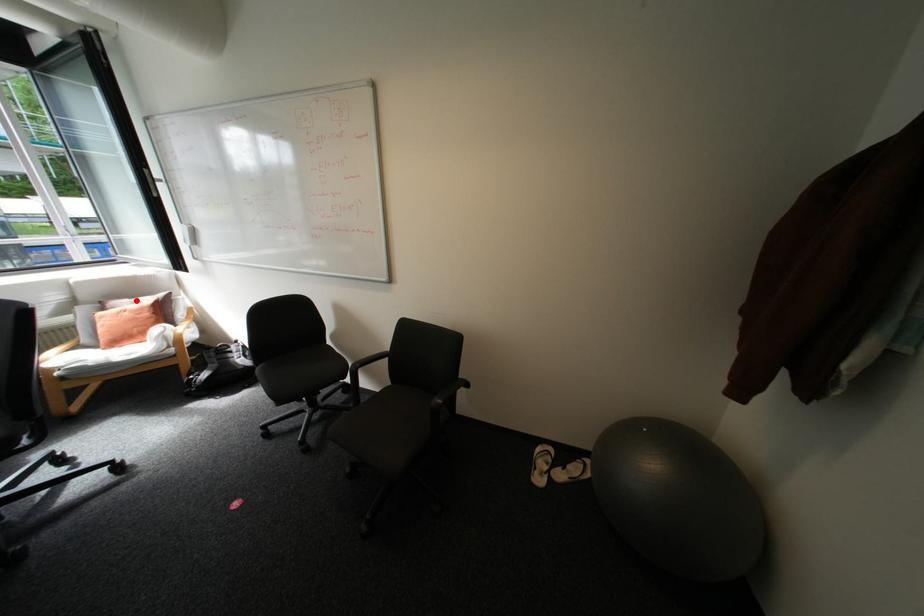
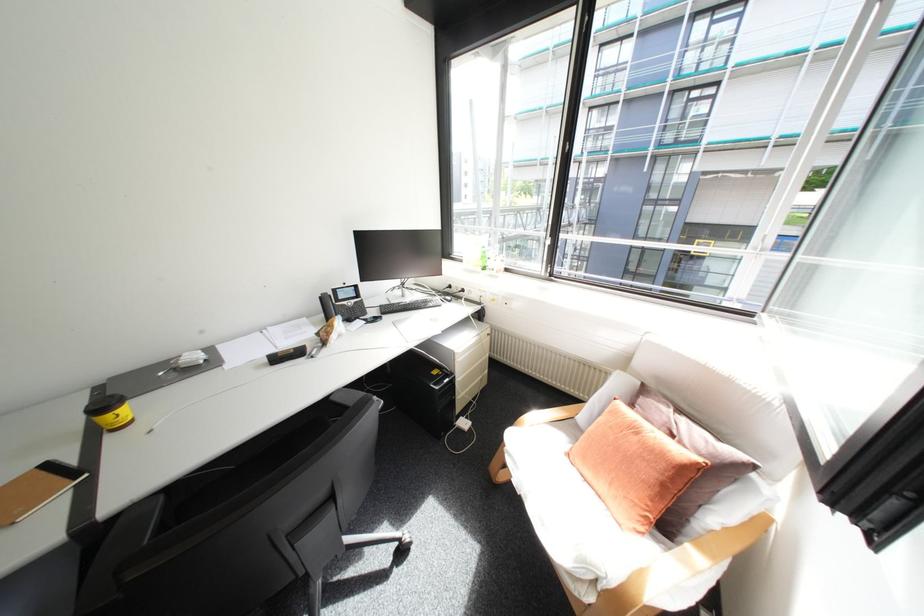
The point at the highlighted location is marked in the first image. Where is the corresponding point in the second image?

(677, 410)